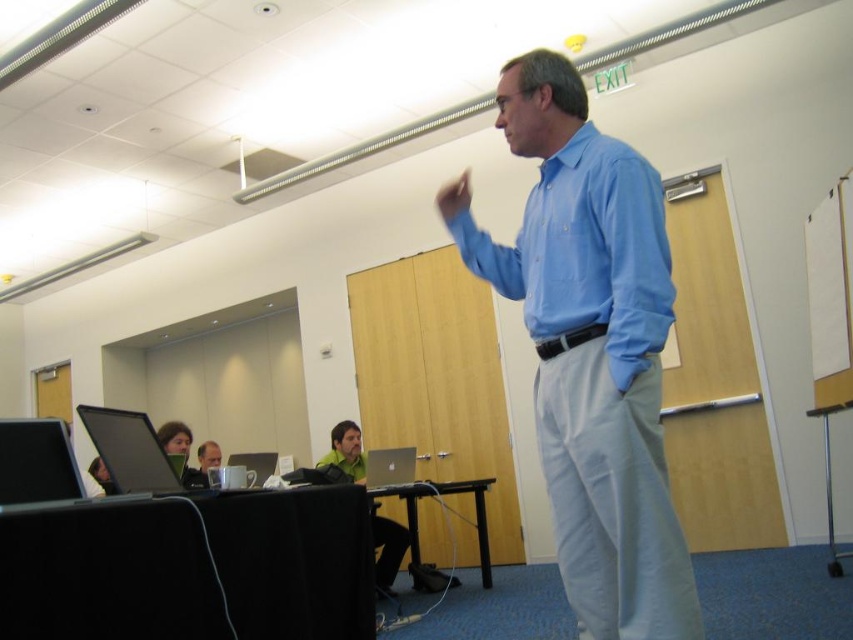
You are organizing a tech event and need to set up two laptops for a presentation. The laptops are the matte black laptop at left and the black glossy laptop at left. Which laptop is placed higher up in the setup?

The black glossy laptop at left is placed higher up since the matte black laptop at left is positioned under it.

You are standing in the conference room and need to locate the person wearing the blue smooth shirt at center. According to the coordinates provided, where exactly is this person positioned within the image?

The blue smooth shirt at center is located at the 2D coordinates point (585, 252) within the image.

You are organizing a group photo and need to arrange two people based on their shirt widths. The blue smooth shirt at center and the green matte shirt at center are both in the scene. Which person should stand on the left if you want the narrower shirt to be on the left?

The blue smooth shirt at center should stand on the left since its width is narrower than the green matte shirt at center.